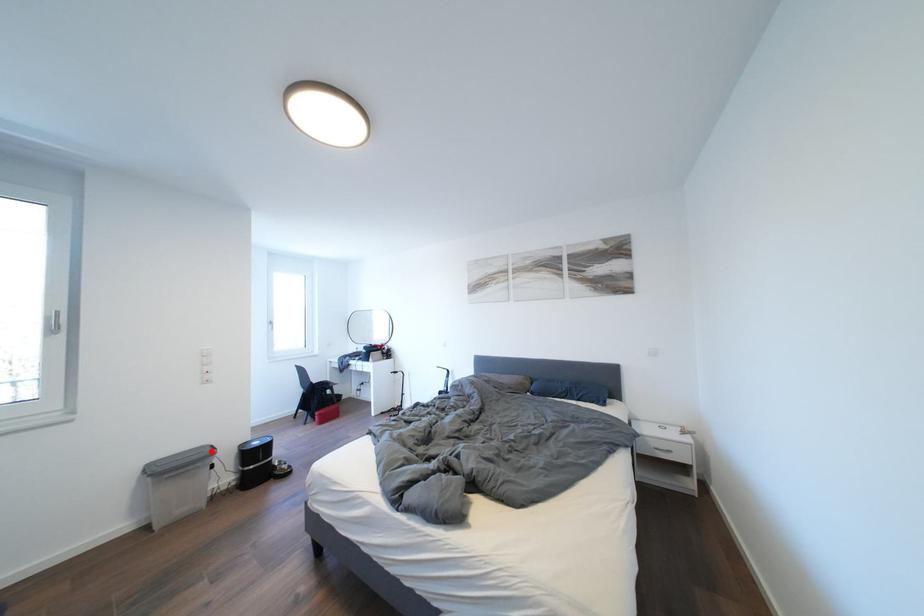
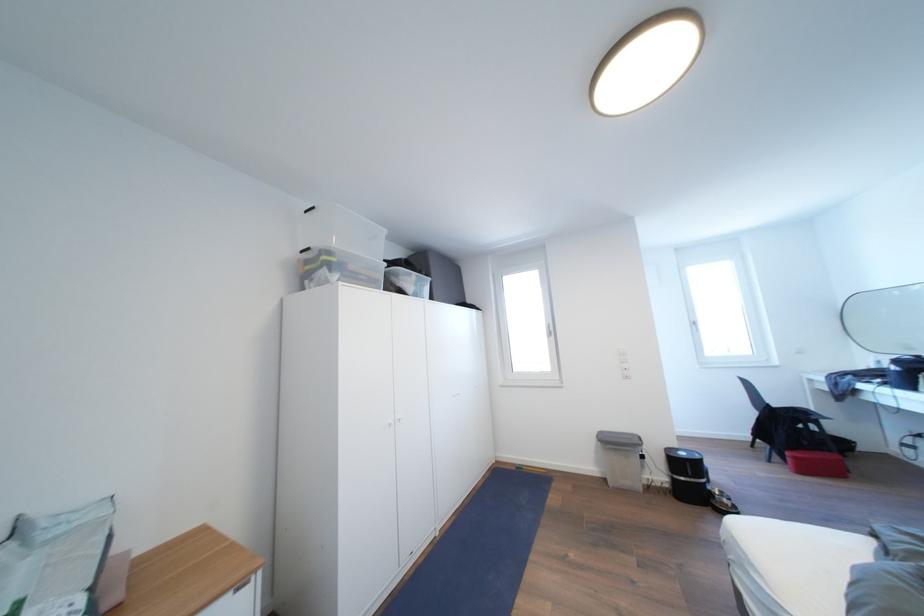
The point at the highlighted location is marked in the first image. Where is the corresponding point in the second image?

(639, 440)